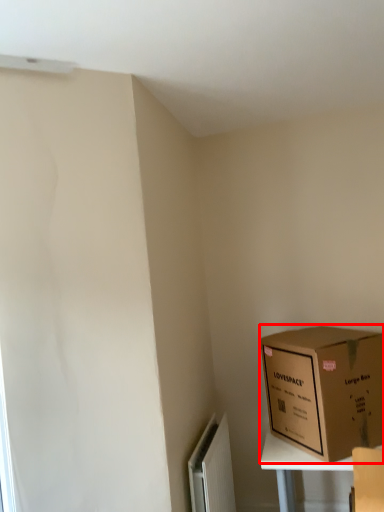
Question: Where is box (annotated by the red box) located in relation to radiator in the image?

Choices:
 (A) left
 (B) right

Answer: (B)